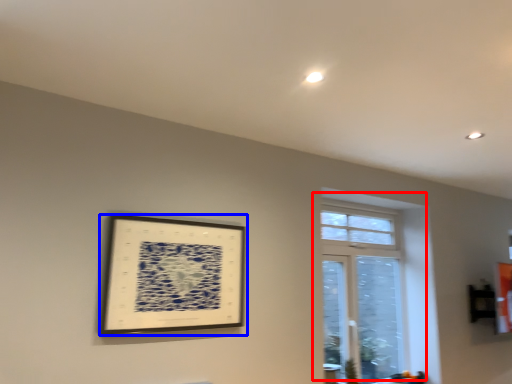
Question: Among these objects, which one is nearest to the camera, window (highlighted by a red box) or picture frame (highlighted by a blue box)?

Choices:
 (A) window
 (B) picture frame

Answer: (B)